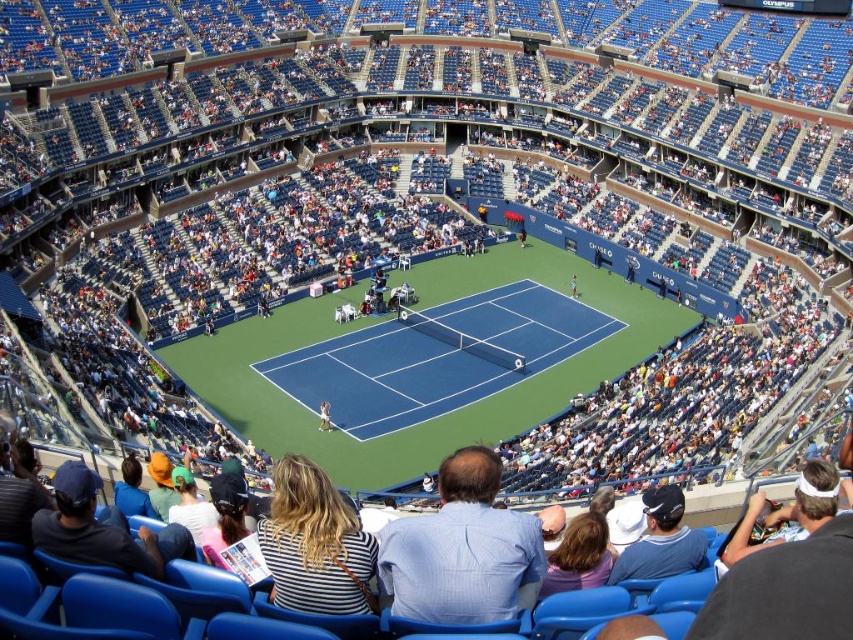
You are a photographer positioned at the edge of the court. You need to capture a photo of both the denim jacket at lower right and the white fabric tennis racket at center. However, you notice that one object might block the view of the other. Based on their sizes, which object could potentially block the other?

The denim jacket at lower right is taller than the white fabric tennis racket at center, so the denim jacket at lower right could potentially block the view of the white fabric tennis racket at center.

You are a photographer trying to capture a photo of the white fabric tennis racket at center without any obstructions. Based on the scene, is the denim jacket at lower right blocking your view of the tennis racket?

The denim jacket at lower right is located below the white fabric tennis racket at center, so it is positioned lower and would not block the view of the tennis racket from above.